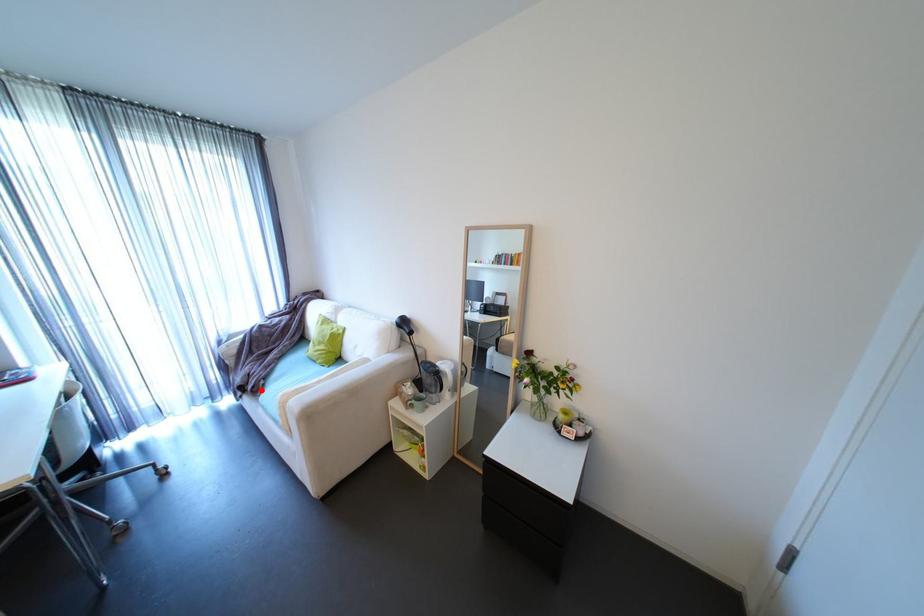
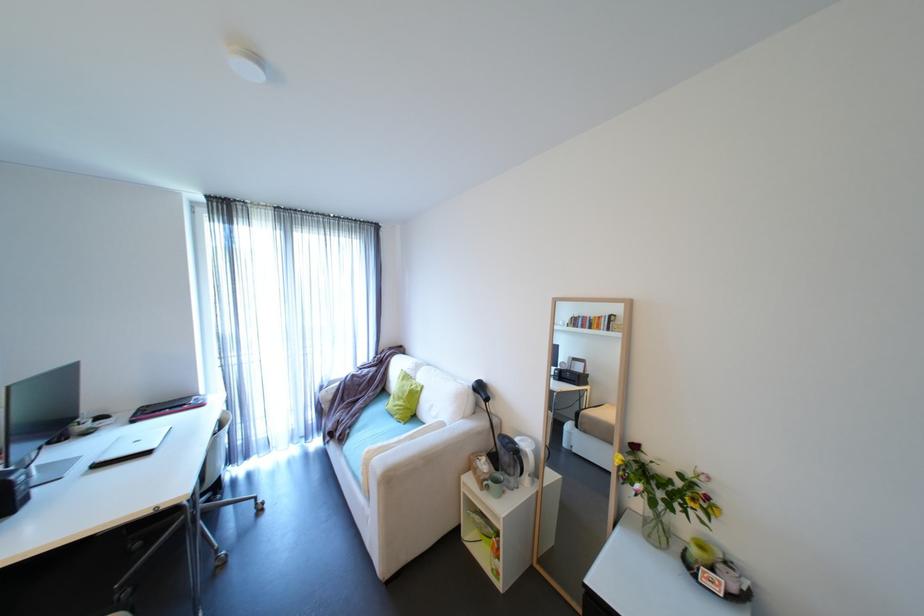
In the second image, find the point that corresponds to the highlighted location in the first image.

(347, 438)